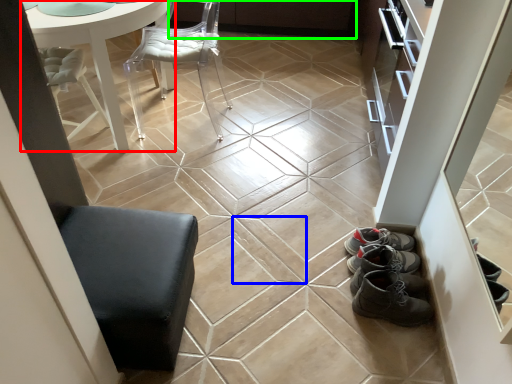
Question: Considering the real-world distances, which object is farthest from table (highlighted by a red box)? ceramic tile (highlighted by a blue box) or cabinetry (highlighted by a green box)?

Choices:
 (A) ceramic tile
 (B) cabinetry

Answer: (B)